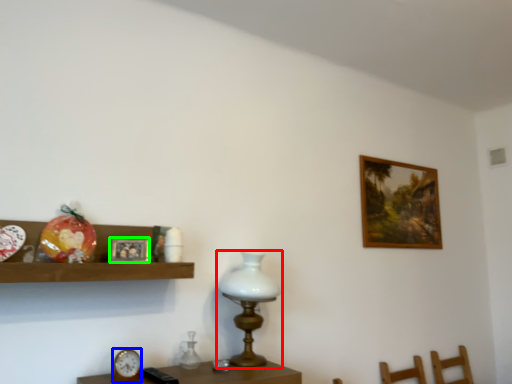
Question: Based on their relative distances, which object is nearer to table lamp (highlighted by a red box)? Choose from clock (highlighted by a blue box) and picture frame (highlighted by a green box).

Choices:
 (A) clock
 (B) picture frame

Answer: (B)